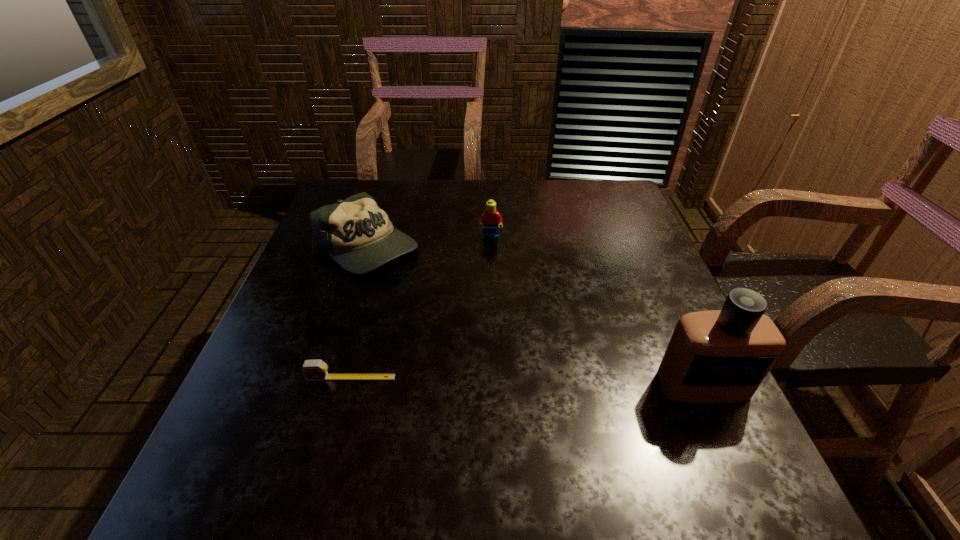
The height and width of the screenshot is (540, 960). In order to click on vacant space that is in between the baseball cap and the shortest object in this screenshot , I will do `click(359, 313)`.

Locate an element on the screen. The image size is (960, 540). vacant area between the second object from right to left and the rightmost object is located at coordinates (597, 312).

Find the location of a particular element. This screenshot has width=960, height=540. free space between the Lego and the shortest object is located at coordinates (420, 308).

The height and width of the screenshot is (540, 960). Identify the location of blank region between the baseball cap and the perfume. (535, 317).

This screenshot has height=540, width=960. I want to click on unoccupied position between the shortest object and the tallest object, so click(527, 381).

In order to click on free space that is in between the tape measure and the baseball cap in this screenshot , I will do `click(359, 313)`.

This screenshot has width=960, height=540. I want to click on the third closest object to the tallest object, so click(x=356, y=233).

Locate an element on the screen. the closest object relative to the Lego is located at coordinates (356, 233).